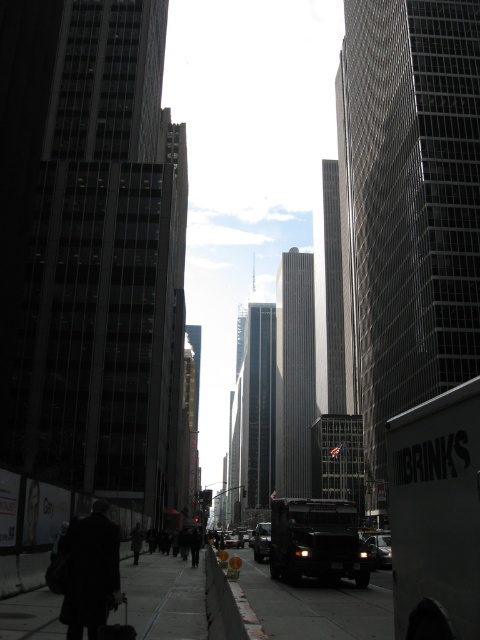
You are standing on the sidewalk and looking at the dark asphalt pavement at lower center and the metallic silver truck at center. Which object is nearer to you?

The dark asphalt pavement at lower center is closer to the viewer than the metallic silver truck at center.

You are a photographer standing on the sidewalk in the bustling urban street scene. You want to take a photo that includes both the dark wool coat at lower left and the metallic silver car at center. Which object should you adjust your camera angle to focus on first to ensure both are in frame?

The dark wool coat at lower left is not as tall as the metallic silver car at center, so you should focus on the metallic silver car at center first to ensure the taller object is fully captured in the frame.